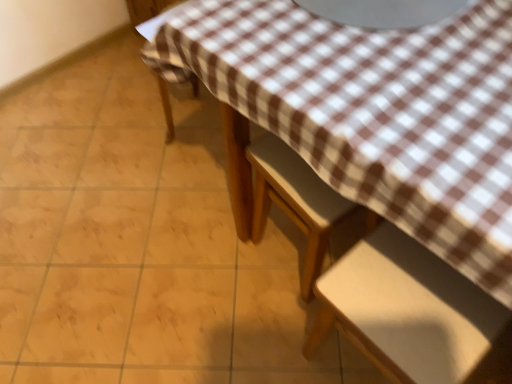
The width and height of the screenshot is (512, 384). Identify the location of free space on the front side of brown checkered fabric at lower left, which is the first chair in top-to-bottom order. (186, 182).